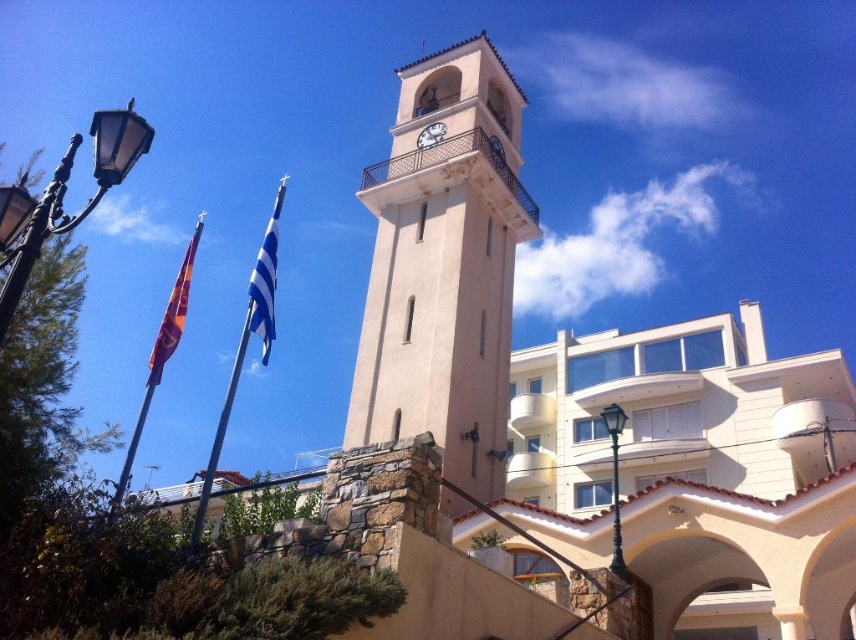
Question: Which of the following is the farthest from the observer?

Choices:
 (A) white textured clock at upper center
 (B) beige stone clock tower at center
 (C) blue fabric flag at upper left

Answer: (A)

Question: Does blue fabric flag at upper left have a smaller size compared to orange fabric flag at left?

Choices:
 (A) no
 (B) yes

Answer: (A)

Question: Is orange fabric flag at left further to camera compared to white textured clock at upper center?

Choices:
 (A) no
 (B) yes

Answer: (A)

Question: Which object is positioned closest to the white textured clock at upper center?

Choices:
 (A) beige stone clock tower at center
 (B) blue fabric flag at upper left
 (C) orange fabric flag at left

Answer: (A)

Question: Which of the following is the farthest from the observer?

Choices:
 (A) blue fabric flag at upper left
 (B) orange fabric flag at left
 (C) beige stone clock tower at center
 (D) white textured clock at upper center

Answer: (D)

Question: Is the position of blue fabric flag at upper left more distant than that of orange fabric flag at left?

Choices:
 (A) no
 (B) yes

Answer: (A)